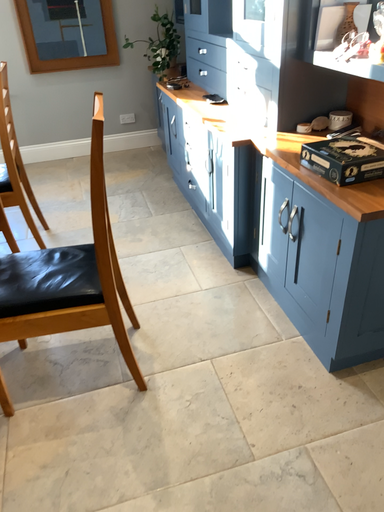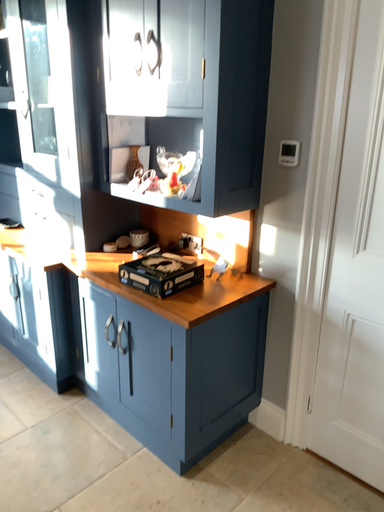
Question: How did the camera likely rotate when shooting the video?

Choices:
 (A) rotated left
 (B) rotated right

Answer: (B)